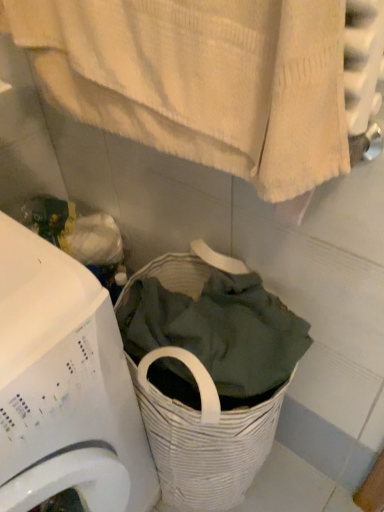
Where is `white textured towel at upper center`? white textured towel at upper center is located at coordinates (202, 80).

Based on the photo, what is the approximate width of white textured towel at upper center?

The width of white textured towel at upper center is 4.65 inches.

Describe the element at coordinates (202, 80) in the screenshot. I see `white textured towel at upper center` at that location.

What do you see at coordinates (64, 385) in the screenshot? I see `white plastic washing machine at lower left` at bounding box center [64, 385].

I want to click on white plastic washing machine at lower left, so click(64, 385).

Measure the distance between point (7, 342) and camera.

The depth of point (7, 342) is 19.76 inches.

Identify the location of white textured towel at upper center. (202, 80).

Visually, is white textured towel at upper center positioned to the left or to the right of white plastic washing machine at lower left?

white textured towel at upper center is positioned on white plastic washing machine at lower left's right side.

Considering their positions, is white textured towel at upper center located in front of or behind white plastic washing machine at lower left?

In the image, white textured towel at upper center appears in front of white plastic washing machine at lower left.

Between point (282, 175) and point (56, 374), which one is positioned in front?

Positioned in front is point (282, 175).

From the image's perspective, is white textured towel at upper center over white plastic washing machine at lower left?

Yes, from the image's perspective, white textured towel at upper center is above white plastic washing machine at lower left.

From a real-world perspective, which object stands above the other?

white textured towel at upper center is physically above.

In terms of width, does white textured towel at upper center look wider or thinner when compared to white plastic washing machine at lower left?

Clearly, white textured towel at upper center has less width compared to white plastic washing machine at lower left.

Which of these two, white textured towel at upper center or white plastic washing machine at lower left, stands taller?

white plastic washing machine at lower left.

Who is bigger, white textured towel at upper center or white plastic washing machine at lower left?

With larger size is white plastic washing machine at lower left.

Is white textured towel at upper center inside the boundaries of white plastic washing machine at lower left, or outside?

white textured towel at upper center exists outside the volume of white plastic washing machine at lower left.

Are white textured towel at upper center and white plastic washing machine at lower left making contact?

white textured towel at upper center is not next to white plastic washing machine at lower left, and they're not touching.

Is white textured towel at upper center turned away from white plastic washing machine at lower left?

No, white plastic washing machine at lower left is not at the back of white textured towel at upper center.

Identify the location of washing machine behind the white textured towel at upper center. This screenshot has height=512, width=384. (64, 385).

Can you confirm if white plastic washing machine at lower left is positioned to the left of white textured towel at upper center?

Yes, white plastic washing machine at lower left is to the left of white textured towel at upper center.

Who is more distant, white plastic washing machine at lower left or white textured towel at upper center?

white plastic washing machine at lower left.

Between point (84, 415) and point (297, 29), which one is positioned behind?

The point (84, 415) is behind.

From the picture: From the image's perspective, is white plastic washing machine at lower left on top of white textured towel at upper center?

No, from the image's perspective, white plastic washing machine at lower left is not on top of white textured towel at upper center.

From a real-world perspective, is white plastic washing machine at lower left located beneath white textured towel at upper center?

Yes.

Considering the sizes of objects white plastic washing machine at lower left and white textured towel at upper center in the image provided, who is wider, white plastic washing machine at lower left or white textured towel at upper center?

white plastic washing machine at lower left is wider.

Who is taller, white plastic washing machine at lower left or white textured towel at upper center?

white plastic washing machine at lower left is taller.

Considering the relative sizes of white plastic washing machine at lower left and white textured towel at upper center in the image provided, is white plastic washing machine at lower left bigger than white textured towel at upper center?

Indeed, white plastic washing machine at lower left has a larger size compared to white textured towel at upper center.

Based on the photo, is white plastic washing machine at lower left situated inside white textured towel at upper center or outside?

white plastic washing machine at lower left is spatially situated outside white textured towel at upper center.

Is white plastic washing machine at lower left next to white textured towel at upper center and touching it?

No, white plastic washing machine at lower left is not in contact with white textured towel at upper center.

Could you tell me if white plastic washing machine at lower left is turned towards white textured towel at upper center?

No, white plastic washing machine at lower left is not turned towards white textured towel at upper center.

How different are the orientations of white plastic washing machine at lower left and white textured towel at upper center in degrees?

They differ by 88.4 degrees in their facing directions.

Measure the distance from white plastic washing machine at lower left to white textured towel at upper center.

white plastic washing machine at lower left and white textured towel at upper center are 14.53 inches apart from each other.

There is a white plastic washing machine at lower left. Identify the location of bath towel above it (from a real-world perspective). The width and height of the screenshot is (384, 512). [202, 80].

You are a GUI agent. You are given a task and a screenshot of the screen. Output one action in this format:
    pyautogui.click(x=<x>, y=<y>)
    Task: Click on the bath towel above the white plastic washing machine at lower left (from the image's perspective)
    The image size is (384, 512).
    Given the screenshot: What is the action you would take?
    pyautogui.click(x=202, y=80)

Identify the location of bath towel in front of the white plastic washing machine at lower left. This screenshot has height=512, width=384. (202, 80).